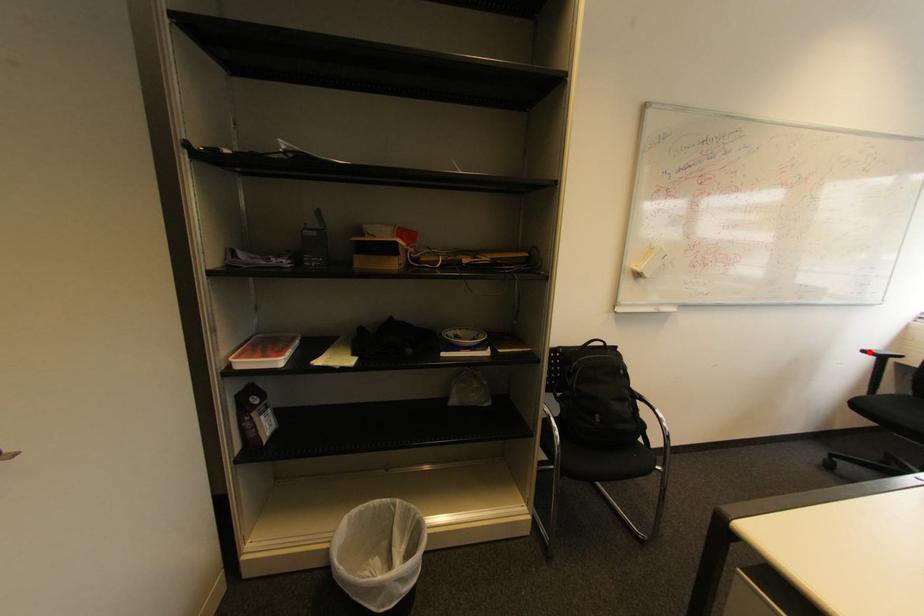
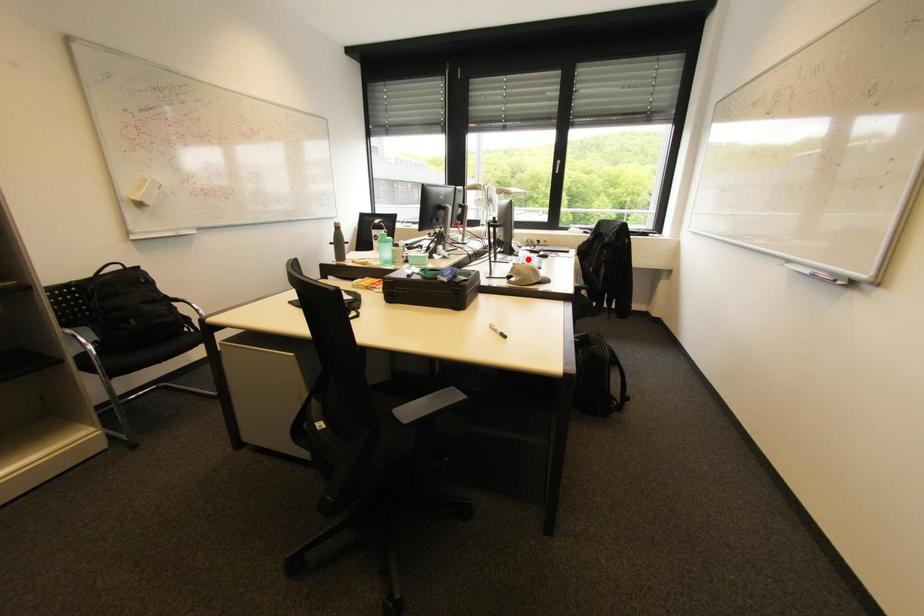
I am providing you with two images of the same scene from different viewpoints. A red point is marked on the first image and another point is marked on the second image. Are the points marked in image1 and image2 representing the same 3D position?

No